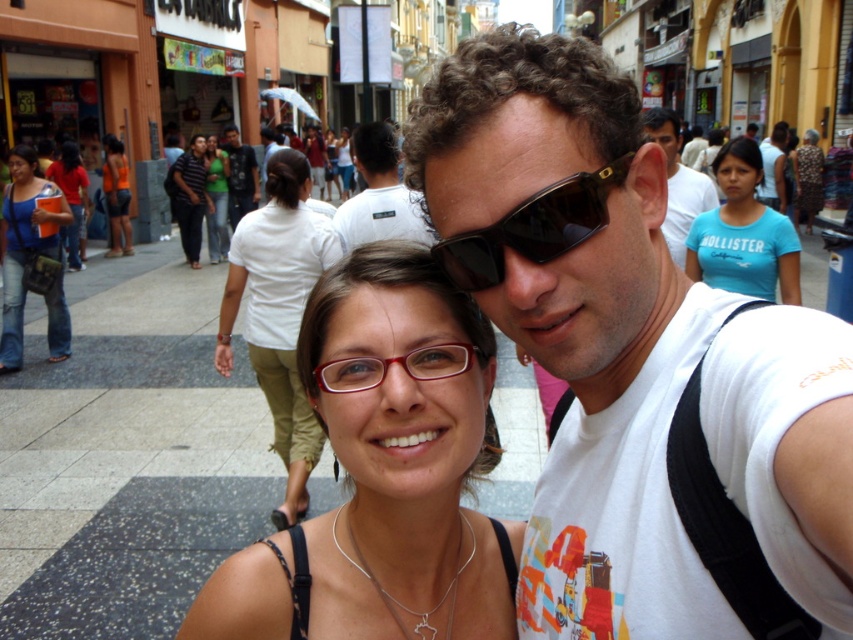
You are a photographer trying to capture a photo of the matte blue shirt at left and the orange fabric shorts at center. From your current position, which one is closer to the right side of the frame?

Result: The matte blue shirt at left is to the right of orange fabric shorts at center, so the matte blue shirt at left is closer to the right side of the frame.